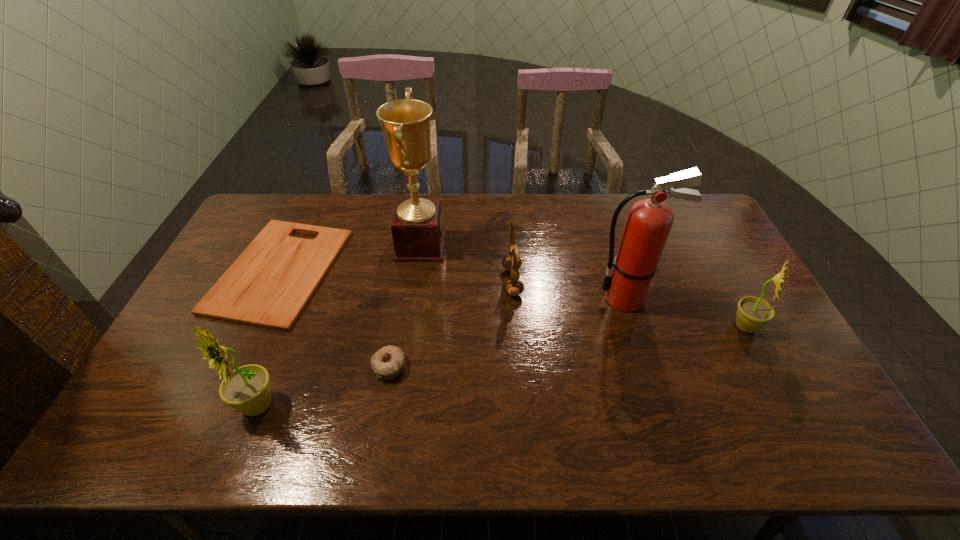
The image size is (960, 540). What are the coordinates of `the nearer sunflower` in the screenshot? It's located at (247, 389).

Where is `the left sunflower`? Image resolution: width=960 pixels, height=540 pixels. the left sunflower is located at coordinates (247, 389).

Identify the location of the shorter sunflower. (753, 313).

The image size is (960, 540). I want to click on the fourth tallest object, so click(x=753, y=313).

You are a GUI agent. You are given a task and a screenshot of the screen. Output one action in this format:
    pyautogui.click(x=<x>, y=<y>)
    Task: Click on the trophy cup
    This screenshot has height=540, width=960.
    Given the screenshot: What is the action you would take?
    pyautogui.click(x=417, y=229)

Locate an element on the screen. the sixth object from left to right is located at coordinates (649, 221).

You are a GUI agent. You are given a task and a screenshot of the screen. Output one action in this format:
    pyautogui.click(x=<x>, y=<y>)
    Task: Click on the earphone
    
    Given the screenshot: What is the action you would take?
    pyautogui.click(x=512, y=262)

Locate an element on the screen. This screenshot has height=540, width=960. the third shortest object is located at coordinates (512, 262).

Locate an element on the screen. Image resolution: width=960 pixels, height=540 pixels. chopping board is located at coordinates (270, 283).

Find the location of a particular element. This screenshot has height=540, width=960. the sixth tallest object is located at coordinates (388, 362).